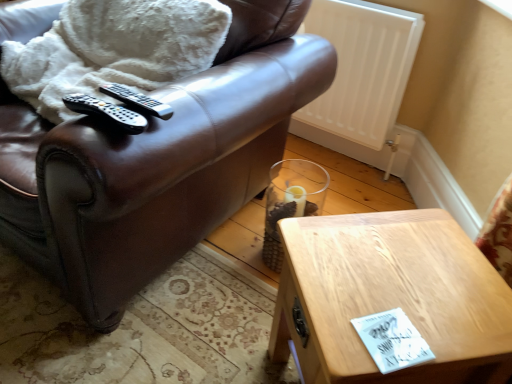
Question: Is white fluffy blanket at upper left oriented away from clear glass vase at lower center?

Choices:
 (A) yes
 (B) no

Answer: (B)

Question: Is white fluffy blanket at upper left closer to camera compared to clear glass vase at lower center?

Choices:
 (A) no
 (B) yes

Answer: (B)

Question: Is the surface of white fluffy blanket at upper left in direct contact with clear glass vase at lower center?

Choices:
 (A) no
 (B) yes

Answer: (A)

Question: Would you consider white fluffy blanket at upper left to be distant from clear glass vase at lower center?

Choices:
 (A) no
 (B) yes

Answer: (A)

Question: Does white fluffy blanket at upper left have a larger size compared to clear glass vase at lower center?

Choices:
 (A) no
 (B) yes

Answer: (B)

Question: Relative to white matte radiator at upper right, is black plastic remote at upper left, the second remote positioned from the front, in front or behind?

Choices:
 (A) front
 (B) behind

Answer: (A)

Question: Based on their sizes in the image, would you say black plastic remote at upper left, which ranks as the first remote in back-to-front order, is bigger or smaller than white matte radiator at upper right?

Choices:
 (A) big
 (B) small

Answer: (B)

Question: Does point (130, 92) appear closer or farther from the camera than point (333, 109)?

Choices:
 (A) closer
 (B) farther

Answer: (A)

Question: From their relative heights in the image, would you say black plastic remote at upper left, the second remote positioned from the front, is taller or shorter than white matte radiator at upper right?

Choices:
 (A) tall
 (B) short

Answer: (B)

Question: From the image's perspective, is black plastic remote at upper left, which ranks as the first remote in back-to-front order, positioned above or below brown leather chair at upper left?

Choices:
 (A) above
 (B) below

Answer: (B)

Question: Relative to brown leather chair at upper left, is black plastic remote at upper left, the second remote positioned from the front, in front or behind?

Choices:
 (A) behind
 (B) front

Answer: (A)

Question: Choose the correct answer: Is black plastic remote at upper left, the second remote positioned from the front, inside brown leather chair at upper left or outside it?

Choices:
 (A) inside
 (B) outside

Answer: (A)

Question: Looking at their shapes, would you say black plastic remote at upper left, which ranks as the first remote in back-to-front order, is wider or thinner than brown leather chair at upper left?

Choices:
 (A) wide
 (B) thin

Answer: (B)

Question: From a real-world perspective, is white fluffy blanket at upper left positioned above or below white matte radiator at upper right?

Choices:
 (A) below
 (B) above

Answer: (B)

Question: From the image's perspective, relative to white matte radiator at upper right, is white fluffy blanket at upper left above or below?

Choices:
 (A) below
 (B) above

Answer: (A)